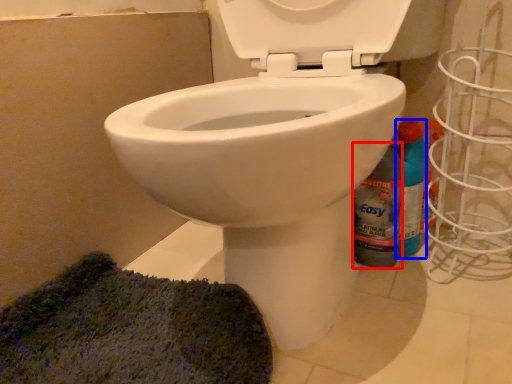
Question: Which object is further to the camera taking this photo, bottle (highlighted by a red box) or cleaning product (highlighted by a blue box)?

Choices:
 (A) bottle
 (B) cleaning product

Answer: (B)